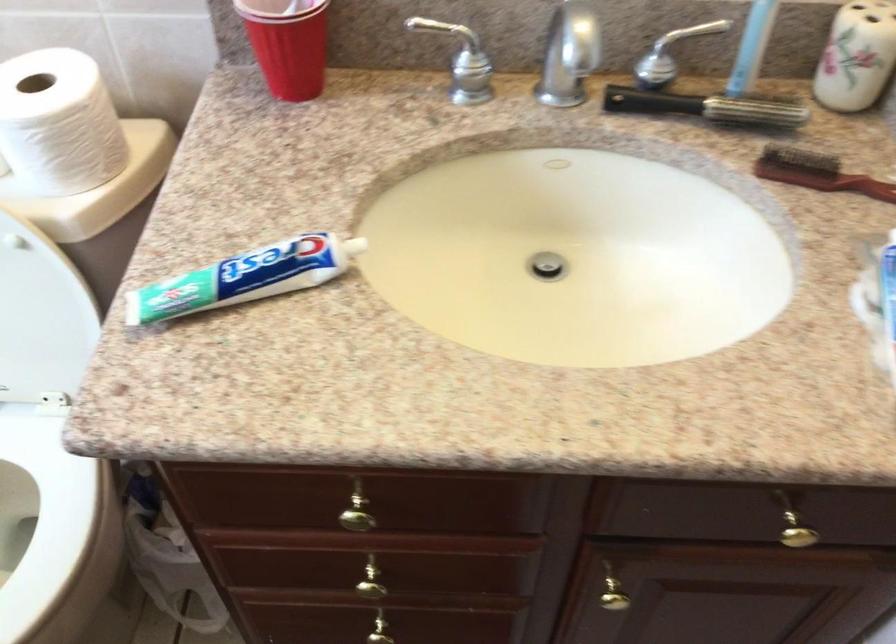
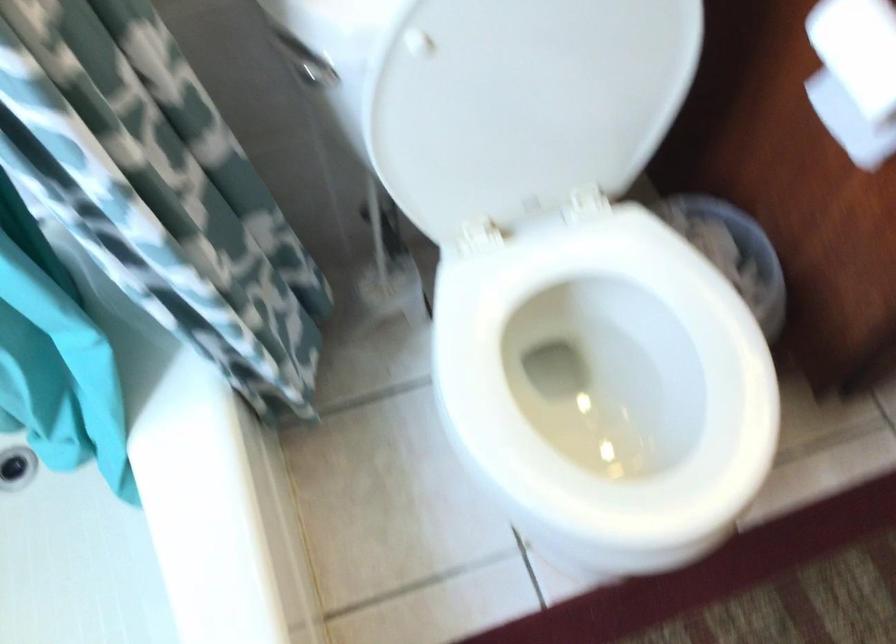
Question: Which direction would the cameraman need to move to produce the second image? Reply with the corresponding letter.

Choices:
 (A) Left
 (B) Right
 (C) Forward
 (D) Backward

Answer: (A)